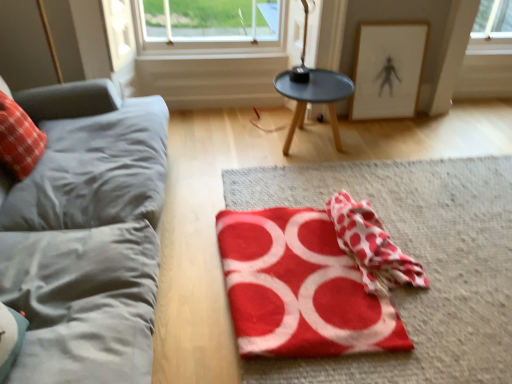
Where is `free location in front of red polka dot fabric at center`? The width and height of the screenshot is (512, 384). free location in front of red polka dot fabric at center is located at coordinates (438, 337).